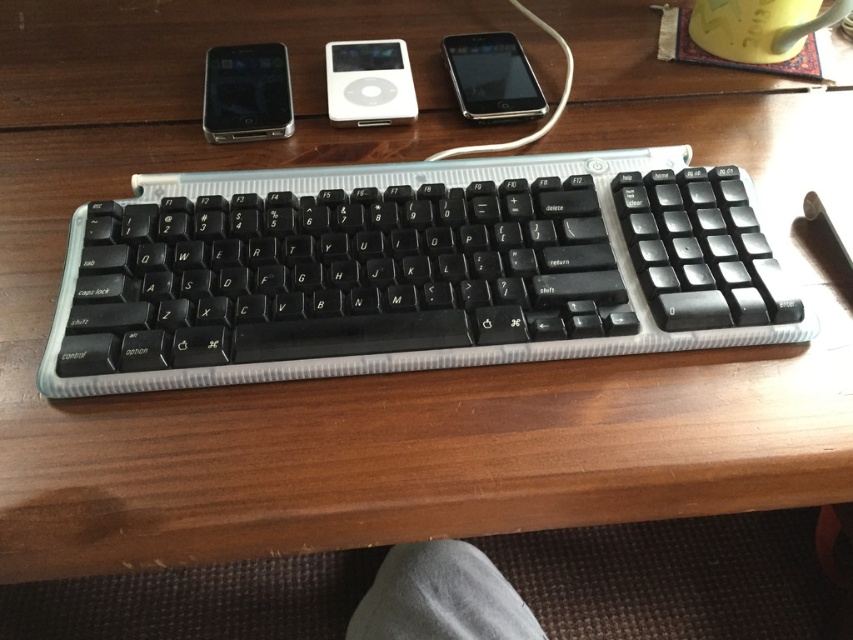
Question: Can you confirm if matte black smartphone at upper left is positioned below sleek black smartphone at center?

Choices:
 (A) no
 (B) yes

Answer: (B)

Question: Is white glossy ipod at center to the right of sleek black smartphone at center from the viewer's perspective?

Choices:
 (A) yes
 (B) no

Answer: (B)

Question: Considering the real-world distances, which object is closest to the white glossy ipod at center?

Choices:
 (A) matte black smartphone at upper left
 (B) black plastic keyboard at center

Answer: (A)

Question: Is black plastic keyboard at center positioned behind sleek black smartphone at center?

Choices:
 (A) no
 (B) yes

Answer: (A)

Question: Which point is closer to the camera taking this photo?

Choices:
 (A) (535, 93)
 (B) (326, 88)
 (C) (264, 44)

Answer: (A)

Question: Which of these objects is positioned farthest from the white glossy ipod at center?

Choices:
 (A) matte black smartphone at upper left
 (B) black plastic keyboard at center
 (C) sleek black smartphone at center

Answer: (B)